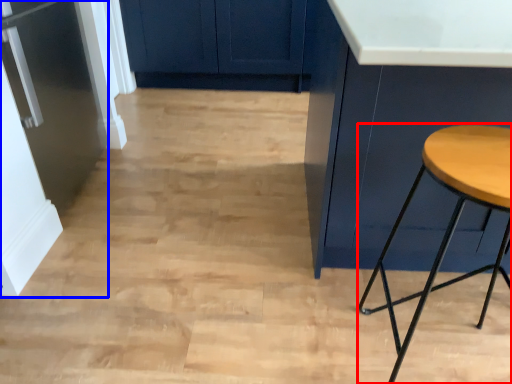
Question: Which of the following is the closest to the observer, stool (highlighted by a red box) or fridge (highlighted by a blue box)?

Choices:
 (A) stool
 (B) fridge

Answer: (A)